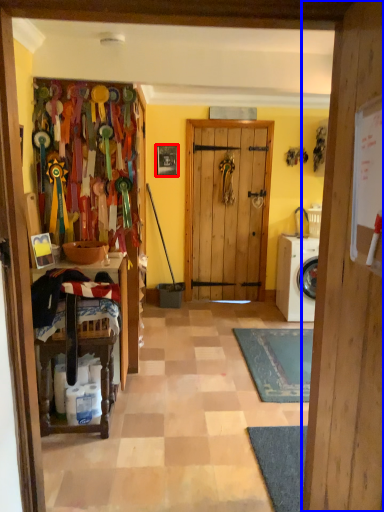
Question: Which object appears farthest to the camera in this image, picture frame (highlighted by a red box) or door (highlighted by a blue box)?

Choices:
 (A) picture frame
 (B) door

Answer: (A)